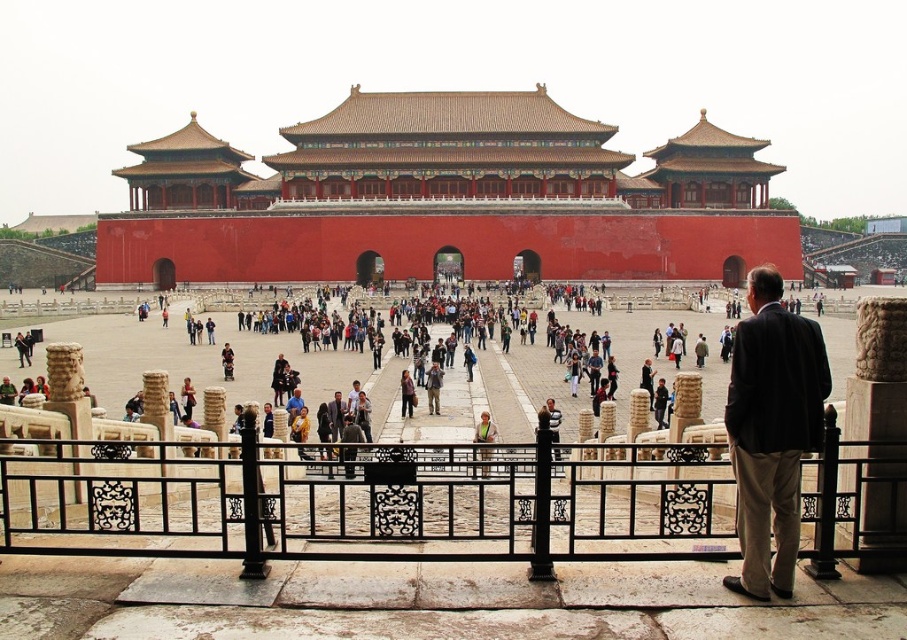
Question: Does dark brown leather jacket at center appear on the left side of dark gray suit at center?

Choices:
 (A) yes
 (B) no

Answer: (B)

Question: Can you confirm if black wrought iron fence at center is wider than dark brown suit at center?

Choices:
 (A) no
 (B) yes

Answer: (B)

Question: Which object appears farthest from the camera in this image?

Choices:
 (A) dark brown suit at center
 (B) dark gray suit at center
 (C) dark brown leather jacket at center
 (D) red painted stone palace at center

Answer: (D)

Question: Which of the following is the closest to the observer?

Choices:
 (A) (359, 426)
 (B) (334, 432)
 (C) (218, 282)
 (D) (781, 314)

Answer: (D)

Question: Which of the following is the closest to the observer?

Choices:
 (A) (348, 456)
 (B) (825, 362)
 (C) (242, 209)

Answer: (B)

Question: Considering the relative positions of black wrought iron fence at center and dark gray suit at center in the image provided, where is black wrought iron fence at center located with respect to dark gray suit at center?

Choices:
 (A) left
 (B) right

Answer: (B)